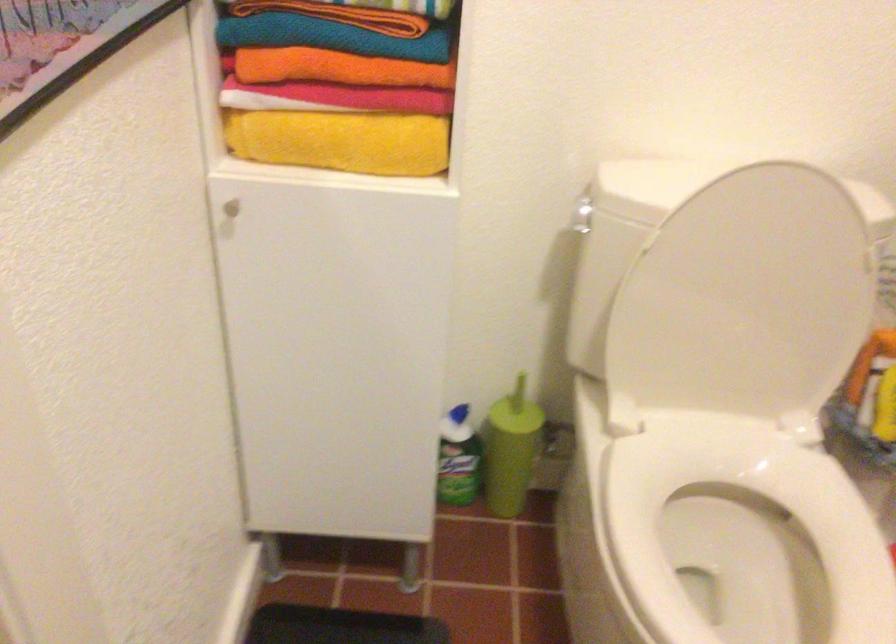
The width and height of the screenshot is (896, 644). Find the location of `blue folded towel`. blue folded towel is located at coordinates (331, 37).